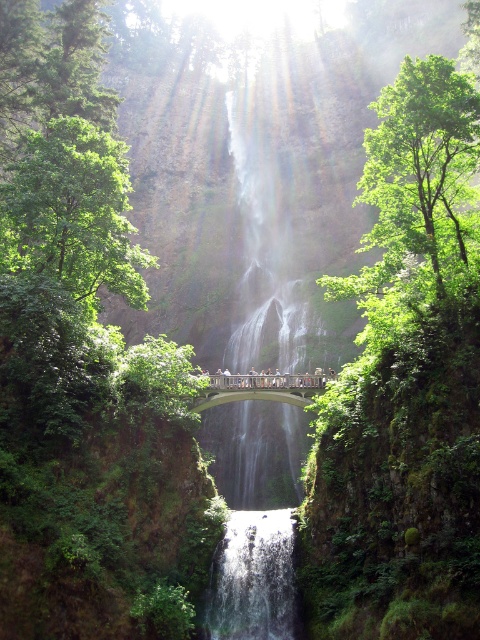
You are standing on the concrete bridge spanning the waterfall and want to locate the point at coordinates point (252, 579). According to the scene description, where would this point be located?

The point (252, 579) is on clear water at center.

You are a hiker standing on the wooden bridge at center. You want to cross to the other side. Is the clear water at center directly beneath your feet as you walk?

The clear water at center is below the wooden bridge at center, so yes, the water is directly beneath your feet as you walk across the bridge.